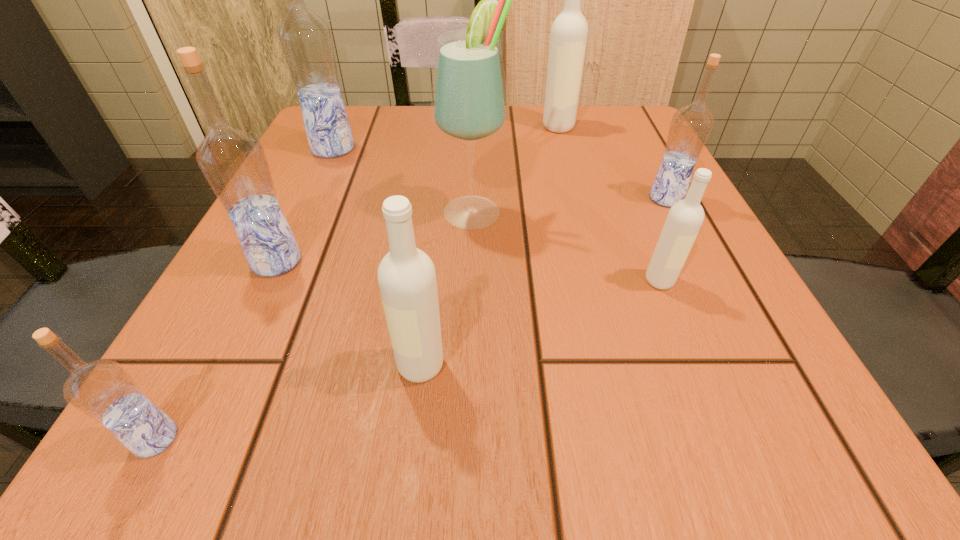
At what (x,y) coordinates should I click in order to perform the action: click on the seventh nearest object. Please return your answer as a coordinate pair (x, y). Looking at the image, I should click on (306, 42).

Identify the location of the tallest vodka. This screenshot has height=540, width=960. (306, 42).

What are the coordinates of `alcohol` in the screenshot? It's located at (469, 104).

In order to click on the farthest white vodka in this screenshot , I will do `click(569, 32)`.

The height and width of the screenshot is (540, 960). What are the coordinates of `the farthest object` in the screenshot? It's located at [x=569, y=32].

Where is `the second biggest blue vodka`? This screenshot has height=540, width=960. the second biggest blue vodka is located at coordinates (234, 163).

Image resolution: width=960 pixels, height=540 pixels. I want to click on the third biggest blue vodka, so click(x=691, y=125).

Where is `the fifth nearest vodka`? The width and height of the screenshot is (960, 540). the fifth nearest vodka is located at coordinates point(691,125).

Locate an element on the screen. the nearest white vodka is located at coordinates (x=407, y=280).

Locate an element on the screen. This screenshot has width=960, height=540. the second nearest vodka is located at coordinates (407, 280).